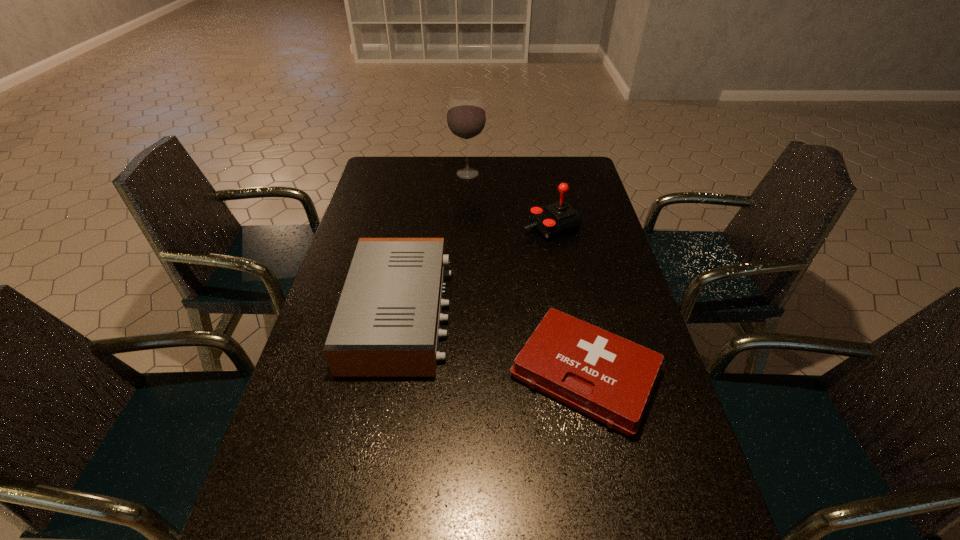
Where is `object situated at the far edge`? object situated at the far edge is located at coordinates (466, 119).

Where is `object that is at the left edge`? The height and width of the screenshot is (540, 960). object that is at the left edge is located at coordinates (387, 323).

Find the location of a particular element. The height and width of the screenshot is (540, 960). joystick positioned at the right edge is located at coordinates (555, 219).

What are the coordinates of `the first-aid kit that is at the right edge` in the screenshot? It's located at (609, 378).

Where is `free space at the far edge of the desktop`? free space at the far edge of the desktop is located at coordinates (491, 165).

In the image, there is a desktop. Identify the location of vacant space at the left edge. (316, 403).

In the image, there is a desktop. At what (x,y) coordinates should I click in order to perform the action: click on vacant space at the right edge. Please return your answer as a coordinate pair (x, y). The height and width of the screenshot is (540, 960). Looking at the image, I should click on (573, 246).

You are a GUI agent. You are given a task and a screenshot of the screen. Output one action in this format:
    pyautogui.click(x=<x>, y=<y>)
    Task: Click on the empty space that is in between the shortest object and the third shortest object
    The image size is (960, 540).
    Given the screenshot: What is the action you would take?
    pyautogui.click(x=568, y=300)

Locate an element on the screen. vacant area that lies between the shortest object and the alcohol is located at coordinates (526, 273).

Find the location of a particular element. free spot between the shortest object and the radio receiver is located at coordinates (492, 343).